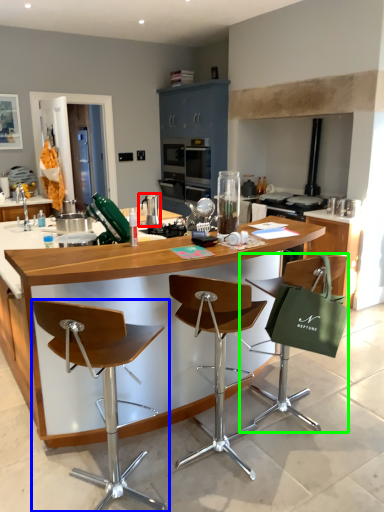
Question: Based on their relative distances, which object is nearer to appliance (highlighted by a red box)? Choose from chair (highlighted by a blue box) and chair (highlighted by a green box).

Choices:
 (A) chair
 (B) chair

Answer: (B)